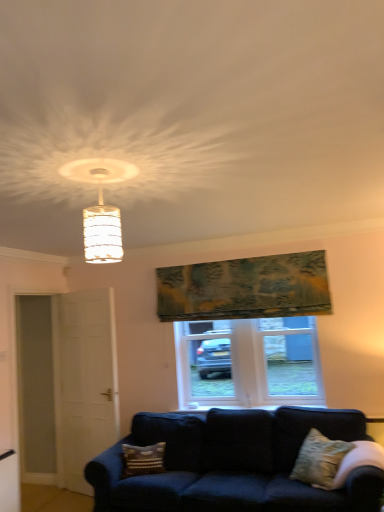
Identify the location of white plastic window at center. click(248, 362).

What do you see at coordinates (245, 288) in the screenshot? The width and height of the screenshot is (384, 512). I see `textured green tapestry at upper center` at bounding box center [245, 288].

The width and height of the screenshot is (384, 512). What do you see at coordinates (86, 380) in the screenshot?
I see `white matte door at left` at bounding box center [86, 380].

How much space does textured beige pillow at lower right, placed as the second pillow when sorted from back to front, occupy horizontally?

The width of textured beige pillow at lower right, placed as the second pillow when sorted from back to front, is 14.19 inches.

This screenshot has width=384, height=512. What do you see at coordinates (319, 459) in the screenshot? I see `textured beige pillow at lower right, placed as the second pillow when sorted from back to front` at bounding box center [319, 459].

Where is `white plastic window at center`? The width and height of the screenshot is (384, 512). white plastic window at center is located at coordinates (248, 362).

Can you tell me how much textured green tapestry at upper center and patterned fabric pillow at lower center, which is the first pillow in left-to-right order, differ in facing direction?

The facing directions of textured green tapestry at upper center and patterned fabric pillow at lower center, which is the first pillow in left-to-right order, are 43.9 degrees apart.

Does point (225, 298) appear closer or farther from the camera than point (162, 442)?

Point (225, 298) is farther from the camera than point (162, 442).

Are textured green tapestry at upper center and patterned fabric pillow at lower center, which is the first pillow in left-to-right order, far apart?

Indeed, textured green tapestry at upper center is not near patterned fabric pillow at lower center, which is the first pillow in left-to-right order.

From a real-world perspective, which object stands above the other?

translucent glass lampshade at upper center is physically above.

From the picture: Is white matte door at left positioned far away from translucent glass lampshade at upper center?

white matte door at left is positioned a significant distance from translucent glass lampshade at upper center.

Find the location of a particular element. The height and width of the screenshot is (512, 384). lamp located above the white matte door at left (from a real-world perspective) is located at coordinates (x=101, y=207).

Which object is positioned more to the right, textured green tapestry at upper center or white matte door at left?

Positioned to the right is textured green tapestry at upper center.

The height and width of the screenshot is (512, 384). Identify the location of tapestry lying in front of the white matte door at left. (245, 288).

Looking at this image, does textured green tapestry at upper center turn towards white matte door at left?

No.

What's the angular difference between textured green tapestry at upper center and white matte door at left's facing directions?

19.7 degrees separate the facing orientations of textured green tapestry at upper center and white matte door at left.

Is translucent glass lampshade at upper center inside the boundaries of patterned fabric pillow at lower center, which ranks as the first pillow in back-to-front order, or outside?

translucent glass lampshade at upper center is not inside patterned fabric pillow at lower center, which ranks as the first pillow in back-to-front order, it's outside.

Looking at this image, could you measure the distance between translucent glass lampshade at upper center and patterned fabric pillow at lower center, positioned as the second pillow in front-to-back order?

They are 7.17 feet apart.

Based on the photo, are translucent glass lampshade at upper center and patterned fabric pillow at lower center, which ranks as the first pillow in back-to-front order, far apart?

translucent glass lampshade at upper center is positioned a significant distance from patterned fabric pillow at lower center, which ranks as the first pillow in back-to-front order.

Is the depth of translucent glass lampshade at upper center greater than that of patterned fabric pillow at lower center, which is the first pillow in left-to-right order?

No, it is in front of patterned fabric pillow at lower center, which is the first pillow in left-to-right order.

The height and width of the screenshot is (512, 384). What are the coordinates of `lamp positioned vertically above the white matte door at left (from a real-world perspective)` in the screenshot? It's located at point(101,207).

Consider the image. Is translucent glass lampshade at upper center beside white matte door at left?

translucent glass lampshade at upper center and white matte door at left are clearly separated.

From a real-world perspective, is translucent glass lampshade at upper center over white matte door at left?

Yes.

Can you confirm if white plastic window at center is thinner than patterned fabric pillow at lower center, which is the first pillow in left-to-right order?

Yes.

Does white plastic window at center appear on the left side of patterned fabric pillow at lower center, acting as the 2th pillow starting from the right?

Incorrect, white plastic window at center is not on the left side of patterned fabric pillow at lower center, acting as the 2th pillow starting from the right.

Does white plastic window at center turn towards patterned fabric pillow at lower center, which ranks as the first pillow in back-to-front order?

Yes.

From the image's perspective, is white plastic window at center on top of white matte door at left?

Yes, from the image's perspective, white plastic window at center is on top of white matte door at left.

How distant is white plastic window at center from white matte door at left?

A distance of 3.78 feet exists between white plastic window at center and white matte door at left.

Between white plastic window at center and white matte door at left, which one is positioned behind?

Positioned behind is white plastic window at center.

Considering the positions of point (210, 391) and point (87, 360), is point (210, 391) closer or farther from the camera than point (87, 360)?

Point (210, 391).

Find the location of a particular element. This screenshot has height=512, width=384. pillow on the left of textured green tapestry at upper center is located at coordinates (143, 459).

The width and height of the screenshot is (384, 512). Identify the location of screen door behind the translucent glass lampshade at upper center. (86, 380).

Based on their spatial positions, is white plastic window at center or textured green tapestry at upper center closer to white matte door at left?

white plastic window at center is positioned closer to the anchor white matte door at left.

Looking at the image, which one is located further to textured beige pillow at lower right, which is counted as the first pillow, starting from the front, textured green tapestry at upper center or white matte door at left?

white matte door at left lies further to textured beige pillow at lower right, which is counted as the first pillow, starting from the front, than the other object.

Estimate the real-world distances between objects in this image. Which object is closer to textured green tapestry at upper center, translucent glass lampshade at upper center or white matte door at left?

The object closer to textured green tapestry at upper center is white matte door at left.

When comparing their distances from white matte door at left, does translucent glass lampshade at upper center or patterned fabric pillow at lower center, which is the first pillow in left-to-right order, seem closer?

The object closer to white matte door at left is patterned fabric pillow at lower center, which is the first pillow in left-to-right order.

Considering their positions, is translucent glass lampshade at upper center positioned further to white plastic window at center than textured green tapestry at upper center?

The object further to white plastic window at center is translucent glass lampshade at upper center.

Which object lies nearer to the anchor point patterned fabric pillow at lower center, which ranks as the first pillow in back-to-front order, white plastic window at center or white matte door at left?

The object closer to patterned fabric pillow at lower center, which ranks as the first pillow in back-to-front order, is white matte door at left.

Based on their spatial positions, is translucent glass lampshade at upper center or textured beige pillow at lower right, placed as the second pillow when sorted from back to front, further from textured green tapestry at upper center?

Based on the image, translucent glass lampshade at upper center appears to be further to textured green tapestry at upper center.

Considering their positions, is patterned fabric pillow at lower center, which ranks as the first pillow in back-to-front order, positioned further to textured beige pillow at lower right, which is counted as the first pillow, starting from the front, than white plastic window at center?

Based on the image, patterned fabric pillow at lower center, which ranks as the first pillow in back-to-front order, appears to be further to textured beige pillow at lower right, which is counted as the first pillow, starting from the front.

You are a GUI agent. You are given a task and a screenshot of the screen. Output one action in this format:
    pyautogui.click(x=<x>, y=<y>)
    Task: Click on the pillow between white matte door at left and textured beige pillow at lower right, placed as the second pillow when sorted from back to front, in the horizontal direction
    The image size is (384, 512).
    Given the screenshot: What is the action you would take?
    pyautogui.click(x=143, y=459)

Where is `tapestry between white matte door at left and white plastic window at center in the horizontal direction`? This screenshot has height=512, width=384. tapestry between white matte door at left and white plastic window at center in the horizontal direction is located at coordinates (245, 288).

You are a GUI agent. You are given a task and a screenshot of the screen. Output one action in this format:
    pyautogui.click(x=<x>, y=<y>)
    Task: Click on the window that lies between textured green tapestry at upper center and patterned fabric pillow at lower center, acting as the 2th pillow starting from the right, from top to bottom
    The image size is (384, 512).
    Given the screenshot: What is the action you would take?
    pyautogui.click(x=248, y=362)

The image size is (384, 512). I want to click on window located between patterned fabric pillow at lower center, acting as the 2th pillow starting from the right, and textured beige pillow at lower right, which ranks as the second pillow in left-to-right order, in the left-right direction, so click(x=248, y=362).